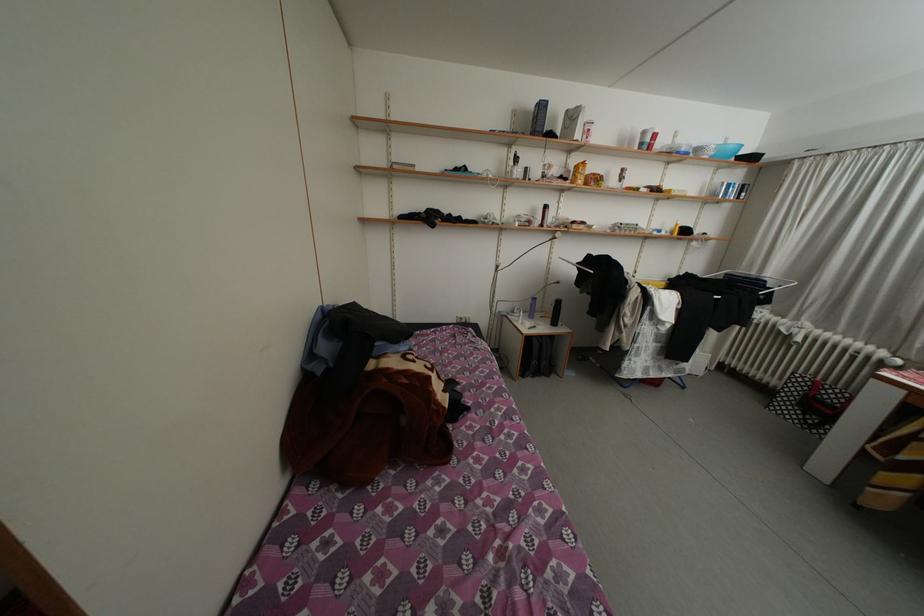
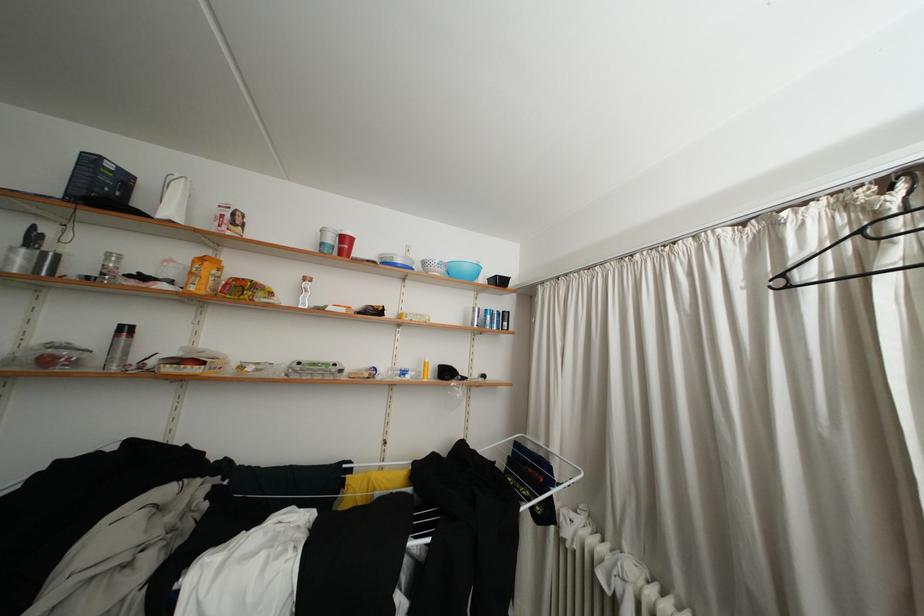
The point at (721, 159) is marked in the first image. Where is the corresponding point in the second image?

(451, 276)